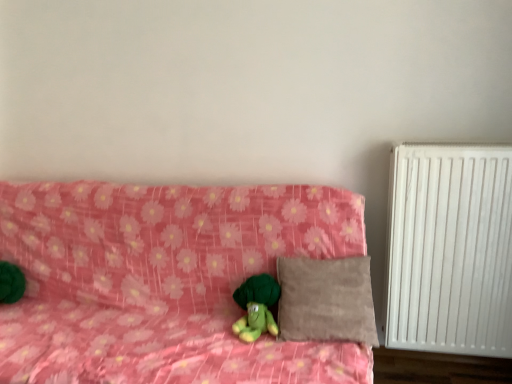
Question: Which is correct: green plush toy at center is inside pink floral fabric couch at center, or outside of it?

Choices:
 (A) inside
 (B) outside

Answer: (A)

Question: Is green plush toy at center to the left or to the right of pink floral fabric couch at center in the image?

Choices:
 (A) left
 (B) right

Answer: (B)

Question: Estimate the real-world distances between objects in this image. Which object is closer to the white matte radiator at right?

Choices:
 (A) beige suede pillow at center
 (B) green plush toy at center
 (C) pink floral fabric couch at center

Answer: (A)

Question: Which is nearer to the beige suede pillow at center?

Choices:
 (A) pink floral fabric couch at center
 (B) green plush toy at center
 (C) white matte radiator at right

Answer: (B)